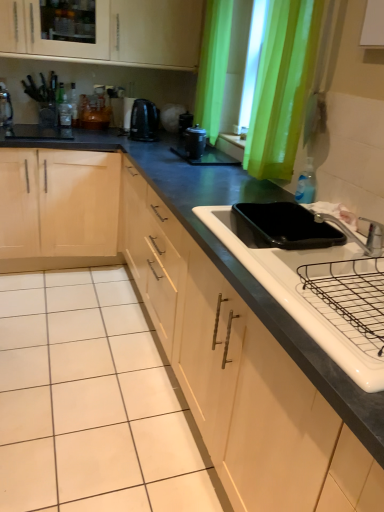
Question: Can you confirm if silver metallic faucet at upper right is taller than blue translucent bottle at sink right, the second bottle from the top?

Choices:
 (A) yes
 (B) no

Answer: (B)

Question: Is silver metallic faucet at upper right bigger than blue translucent bottle at sink right, marked as the 2th bottle in a back-to-front arrangement?

Choices:
 (A) no
 (B) yes

Answer: (B)

Question: Is silver metallic faucet at upper right far away from blue translucent bottle at sink right, arranged as the 2th bottle when viewed from the left?

Choices:
 (A) no
 (B) yes

Answer: (A)

Question: Does silver metallic faucet at upper right appear on the left side of blue translucent bottle at sink right, the 1th bottle viewed from the right?

Choices:
 (A) yes
 (B) no

Answer: (A)

Question: Is silver metallic faucet at upper right positioned behind blue translucent bottle at sink right, marked as the 2th bottle in a back-to-front arrangement?

Choices:
 (A) no
 (B) yes

Answer: (A)

Question: Is white glossy sink at lower right wider or thinner than blue translucent bottle at sink right, the 1th bottle when ordered from bottom to top?

Choices:
 (A) thin
 (B) wide

Answer: (B)

Question: Does point (274, 287) appear closer or farther from the camera than point (304, 177)?

Choices:
 (A) closer
 (B) farther

Answer: (A)

Question: In the image, is white glossy sink at lower right positioned in front of or behind blue translucent bottle at sink right, the second bottle from the top?

Choices:
 (A) behind
 (B) front

Answer: (B)

Question: Based on their sizes in the image, would you say white glossy sink at lower right is bigger or smaller than blue translucent bottle at sink right, the 1th bottle in the front-to-back sequence?

Choices:
 (A) big
 (B) small

Answer: (A)

Question: Is point (269, 121) closer or farther from the camera than point (326, 229)?

Choices:
 (A) closer
 (B) farther

Answer: (B)

Question: From the image's perspective, relative to black matte pizza pan at sink, is green fabric curtain at upper right above or below?

Choices:
 (A) below
 (B) above

Answer: (B)

Question: Do you think green fabric curtain at upper right is within black matte pizza pan at sink, or outside of it?

Choices:
 (A) inside
 (B) outside

Answer: (B)

Question: From a real-world perspective, is green fabric curtain at upper right above or below black matte pizza pan at sink?

Choices:
 (A) below
 (B) above

Answer: (B)

Question: Is black matte pizza pan at sink in front of or behind blue translucent bottle at sink right, the second bottle from the top, in the image?

Choices:
 (A) front
 (B) behind

Answer: (A)

Question: From the image's perspective, is black matte pizza pan at sink above or below blue translucent bottle at sink right, arranged as the 2th bottle when viewed from the left?

Choices:
 (A) above
 (B) below

Answer: (B)